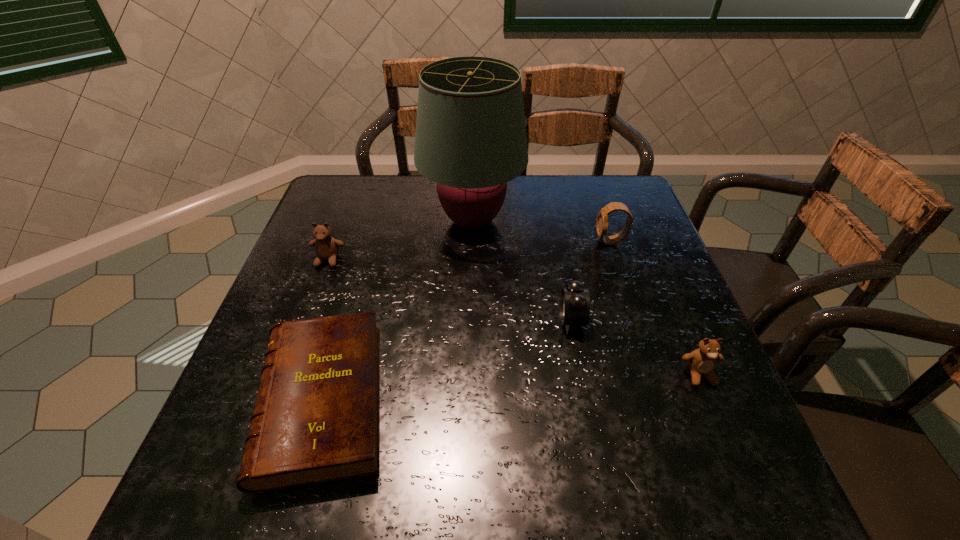
Locate an element on the screen. The image size is (960, 540). vacant space at the far right corner of the desktop is located at coordinates (616, 214).

Image resolution: width=960 pixels, height=540 pixels. Identify the location of vacant point located between the tallest object and the hardback book. (397, 311).

Where is `empty space that is in between the fourth object from right to left and the left teddy bear`? The height and width of the screenshot is (540, 960). empty space that is in between the fourth object from right to left and the left teddy bear is located at coordinates (400, 240).

Find the location of `free space between the rightmost object and the third object from right to left`. free space between the rightmost object and the third object from right to left is located at coordinates (636, 347).

Locate an element on the screen. The image size is (960, 540). vacant point located between the shortest object and the fourth object from left to right is located at coordinates (446, 360).

The image size is (960, 540). In order to click on vacant area that lies between the farther teddy bear and the right teddy bear in this screenshot , I will do `click(514, 318)`.

Image resolution: width=960 pixels, height=540 pixels. Identify the location of vacant area between the right teddy bear and the left teddy bear. (514, 318).

Where is `free area in between the alarm clock and the watch`? free area in between the alarm clock and the watch is located at coordinates (591, 281).

Identify the location of free space between the tallest object and the left teddy bear. (400, 240).

Identify which object is located as the third nearest to the fourth object from right to left. Please provide its 2D coordinates. Your answer should be formatted as a tuple, i.e. [(x, y)], where the tuple contains the x and y coordinates of a point satisfying the conditions above.

[(602, 222)]